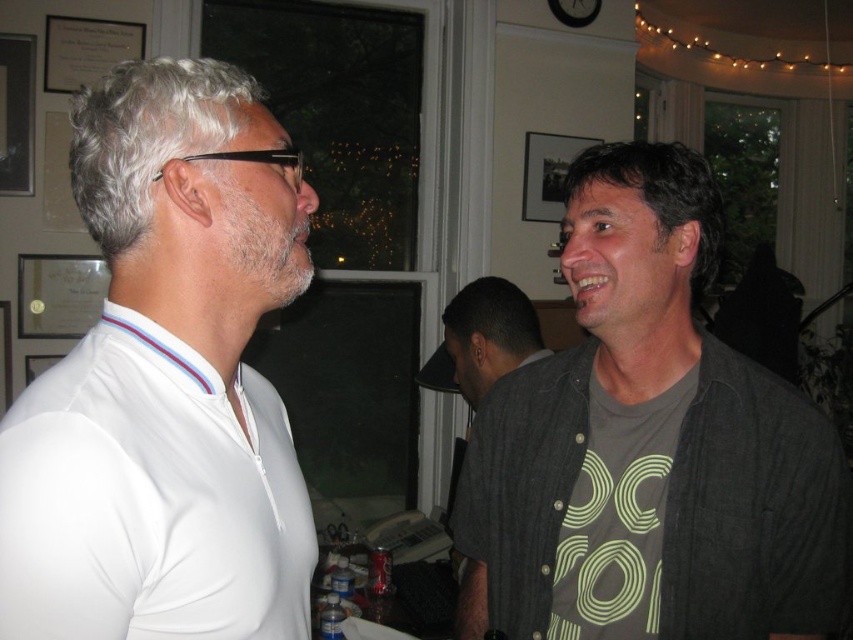
Looking at this image, which of these two, white smooth shirt at left or dark gray shirt at right, stands taller?

dark gray shirt at right

Is point (260, 237) closer to viewer compared to point (666, 420)?

Yes, it is.

Find the location of a particular element. The width and height of the screenshot is (853, 640). white smooth shirt at left is located at coordinates (166, 381).

Is dark gray shirt at right positioned in front of dark gray shirt at center?

Yes, it is in front of dark gray shirt at center.

Measure the distance between dark gray shirt at right and dark gray shirt at center.

They are 28.92 inches apart.

The image size is (853, 640). In order to click on dark gray shirt at right in this screenshot , I will do `click(648, 445)`.

At what (x,y) coordinates should I click in order to perform the action: click on dark gray shirt at right. Please return your answer as a coordinate pair (x, y). The width and height of the screenshot is (853, 640). Looking at the image, I should click on (648, 445).

Based on the photo, can you confirm if white smooth shirt at left is wider than dark gray shirt at center?

Indeed, white smooth shirt at left has a greater width compared to dark gray shirt at center.

Find the location of a particular element. white smooth shirt at left is located at coordinates (166, 381).

Which is behind, point (178, 269) or point (509, 340)?

The point (509, 340) is more distant.

I want to click on white smooth shirt at left, so click(166, 381).